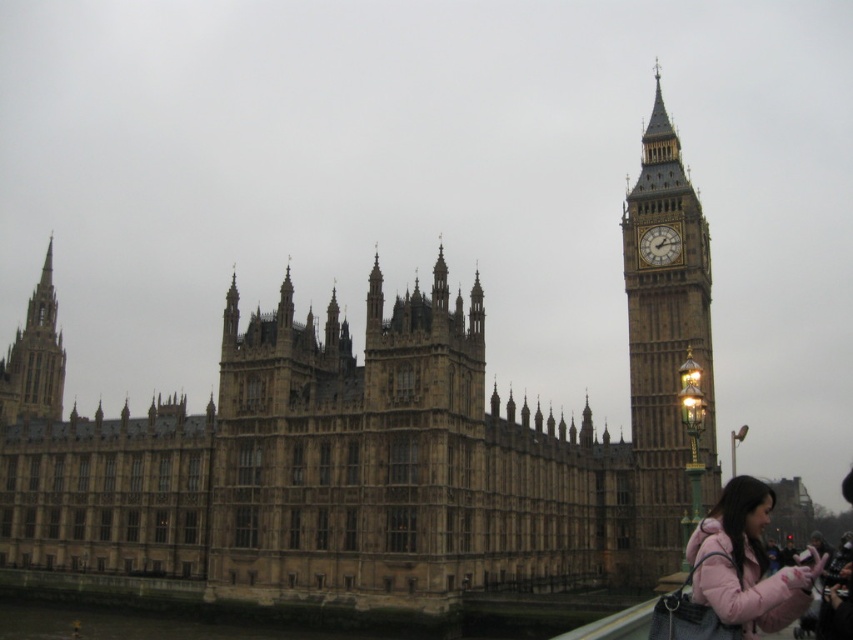
You are a tourist in London and see the brown stone clock tower at right and the pink fleece jacket at lower right in the image. Which object is positioned higher in the scene?

The brown stone clock tower at right is located above the pink fleece jacket at lower right, so it is positioned higher in the scene.

You are standing in front of the Palace of Westminster and want to take a photo of the brown stone clock tower at right. If you are exactly 244.87 feet away from it, will you be able to capture the entire tower in your smartphone camera frame?

The brown stone clock tower at right is 244.87 feet from viewer. Since smartphones have a wide enough angle to capture distant tall structures at that distance, you should be able to capture the entire tower in your smartphone camera frame.

Looking at this image, you are standing at the point marked as point (x=695, y=332), which is 381.27 feet away from the camera. You want to take a photo of the Palace of Westminster and Big Ben in the background. Is the distance between you and the camera sufficient to capture the entire Palace of Westminster and Big Ben in your photo?

The distance between you and the camera is 381.27 feet. Since the Palace of Westminster and Big Ben are part of the background in the scene, and you are positioned at point (x=695, y=332), this distance should allow you to capture the entire structure in your photo as the camera can encompass the background elements from that vantage point.